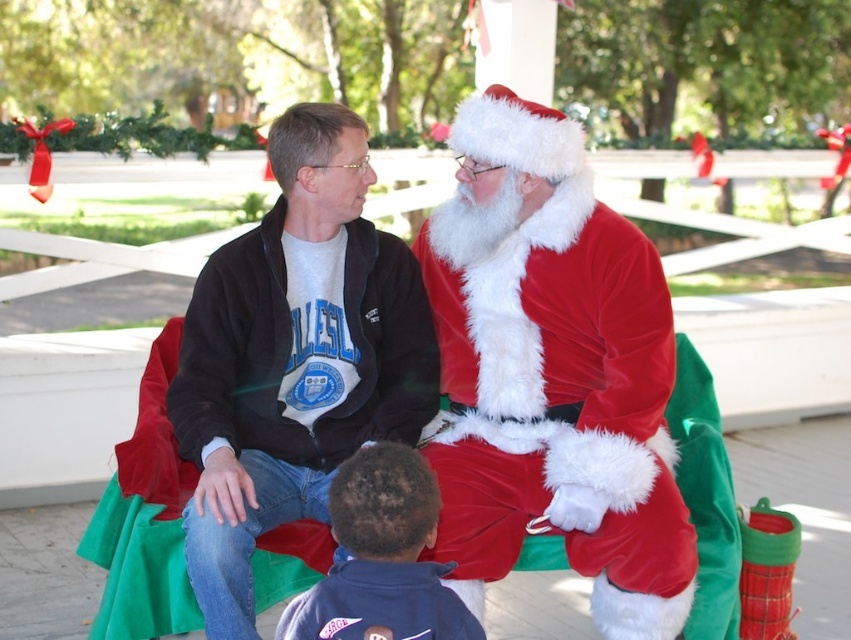
Between velvet santa claus at center and matte black jacket at center, which one is positioned higher?

velvet santa claus at center is above.

Can you confirm if velvet santa claus at center is positioned below matte black jacket at center?

No.

Who is more distant from viewer, (x=638, y=433) or (x=187, y=436)?

Positioned behind is point (x=638, y=433).

Image resolution: width=851 pixels, height=640 pixels. I want to click on velvet santa claus at center, so click(x=552, y=372).

Who is shorter, velvet santa claus at center or dark blue fleece jacket at lower center?

dark blue fleece jacket at lower center is shorter.

You are a GUI agent. You are given a task and a screenshot of the screen. Output one action in this format:
    pyautogui.click(x=<x>, y=<y>)
    Task: Click on the velvet santa claus at center
    
    Given the screenshot: What is the action you would take?
    [x=552, y=372]

Where is `velvet santa claus at center`? The height and width of the screenshot is (640, 851). velvet santa claus at center is located at coordinates (552, 372).

Which is above, matte black jacket at center or dark blue fleece jacket at lower center?

Positioned higher is matte black jacket at center.

Is point (223, 593) farther from viewer compared to point (424, 500)?

Yes, point (223, 593) is farther from viewer.

This screenshot has width=851, height=640. Identify the location of matte black jacket at center. (294, 356).